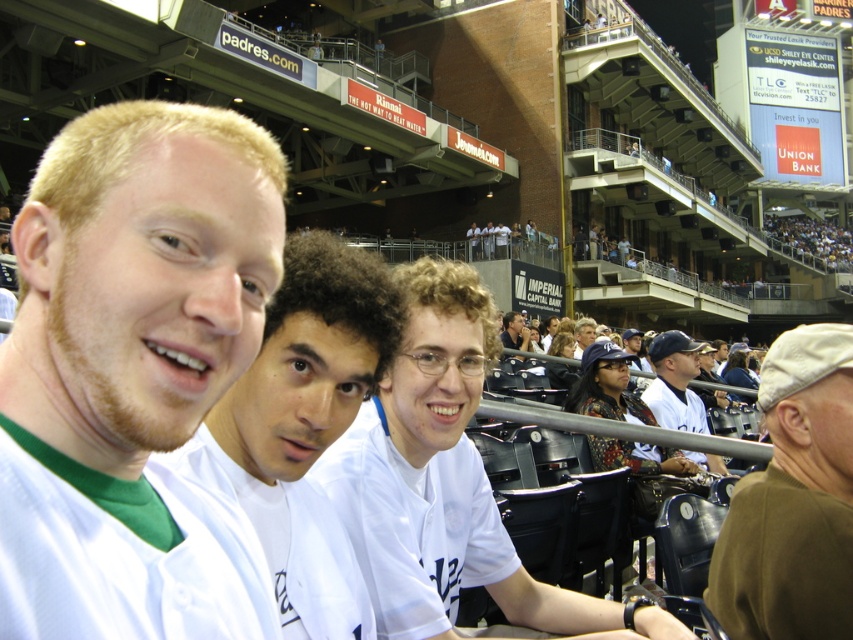
Question: Which of the following is the farthest from the observer?

Choices:
 (A) (524, 348)
 (B) (221, 241)

Answer: (A)

Question: Where is matte white jersey at center located in relation to brown cotton cap at right in the image?

Choices:
 (A) right
 (B) left

Answer: (B)

Question: Which point appears farthest from the camera in this image?

Choices:
 (A) (347, 342)
 (B) (653, 364)
 (C) (364, 508)
 (D) (756, 620)

Answer: (B)

Question: Does brown cotton cap at right appear on the right side of matte white shirt at center?

Choices:
 (A) yes
 (B) no

Answer: (A)

Question: Which object is positioned farthest from the brown cotton cap at right?

Choices:
 (A) white t-shirt at center
 (B) matte white jersey at center

Answer: (B)

Question: Is white jersey at center to the left of white t-shirt at center from the viewer's perspective?

Choices:
 (A) no
 (B) yes

Answer: (A)